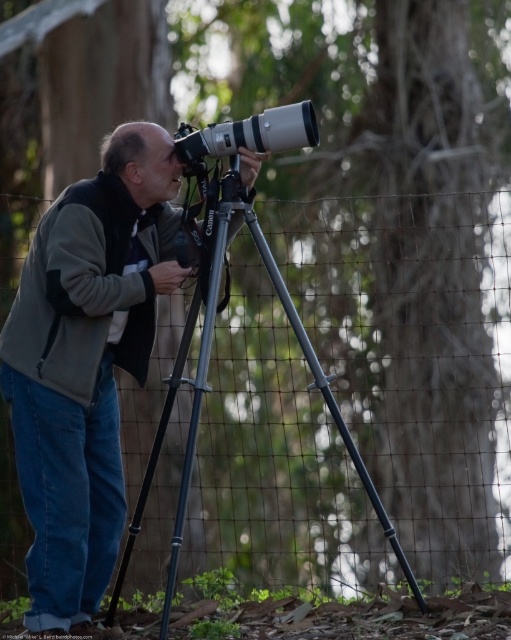
You are a photographer carrying a large backpack. You want to set up your equipment without blocking the view of the matte gray jacket at center. Since the metallic gray tripod at center is in the way, can you move it to the side?

The metallic gray tripod at center is larger than the matte gray jacket at center, so you can move it to the side without blocking the jacket as long as you place it away from the central area.

You are a photographer carrying a matte gray jacket at center and a matte silver lens at center. Which item should you prioritize packing first if you have limited space in your bag?

The matte gray jacket at center is larger than the matte silver lens at center, so you should prioritize packing the matte silver lens at center first to save space.